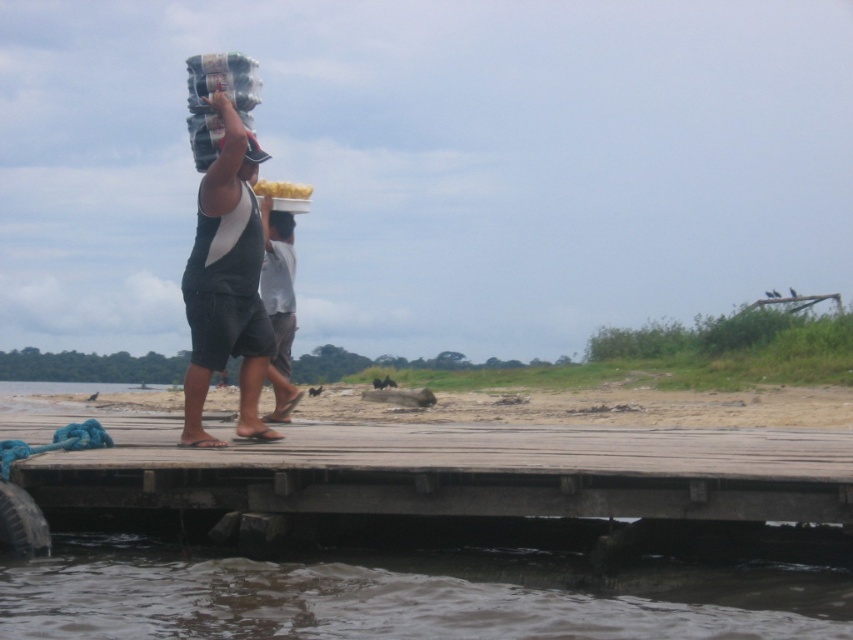
Is brown murky water at lower left positioned in front of dark gray shorts at center?

Yes, it is.

Does brown murky water at lower left appear on the right side of dark gray shorts at center?

Yes, brown murky water at lower left is to the right of dark gray shorts at center.

Describe the element at coordinates (405, 595) in the screenshot. I see `brown murky water at lower left` at that location.

Find the location of `brown murky water at lower left`. brown murky water at lower left is located at coordinates (405, 595).

Is point (227, 100) positioned behind point (289, 360)?

No.

Can you confirm if dark gray fabric shirt at center is positioned above dark gray shorts at center?

Yes.

Locate an element on the screen. dark gray fabric shirt at center is located at coordinates (225, 285).

Can you confirm if wooden dock at center is positioned to the right of dark gray fabric shirt at center?

Correct, you'll find wooden dock at center to the right of dark gray fabric shirt at center.

Can you confirm if wooden dock at center is shorter than dark gray fabric shirt at center?

Indeed, wooden dock at center has a lesser height compared to dark gray fabric shirt at center.

Is point (10, 422) farther from viewer compared to point (262, 244)?

That is True.

Find the location of a particular element. This screenshot has height=640, width=853. wooden dock at center is located at coordinates (x=462, y=472).